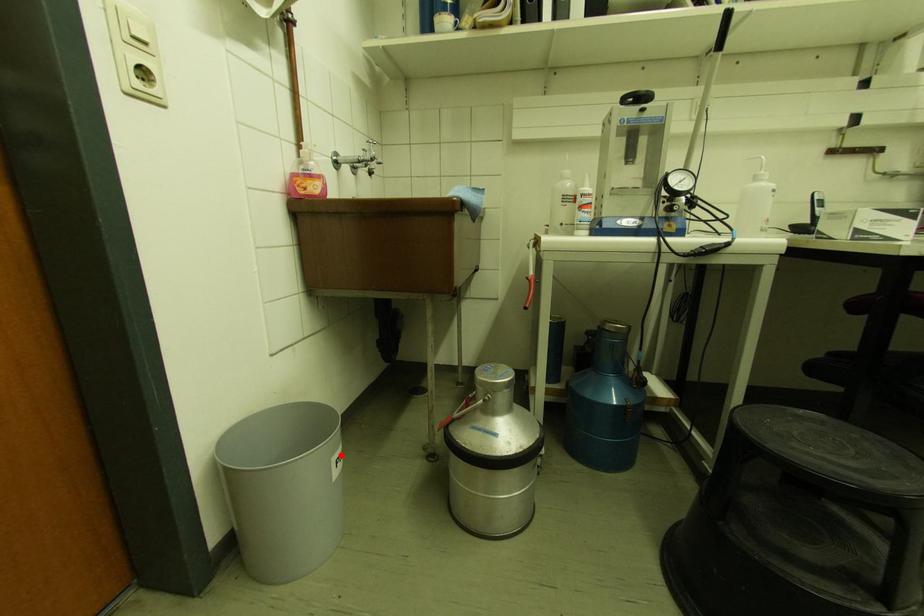
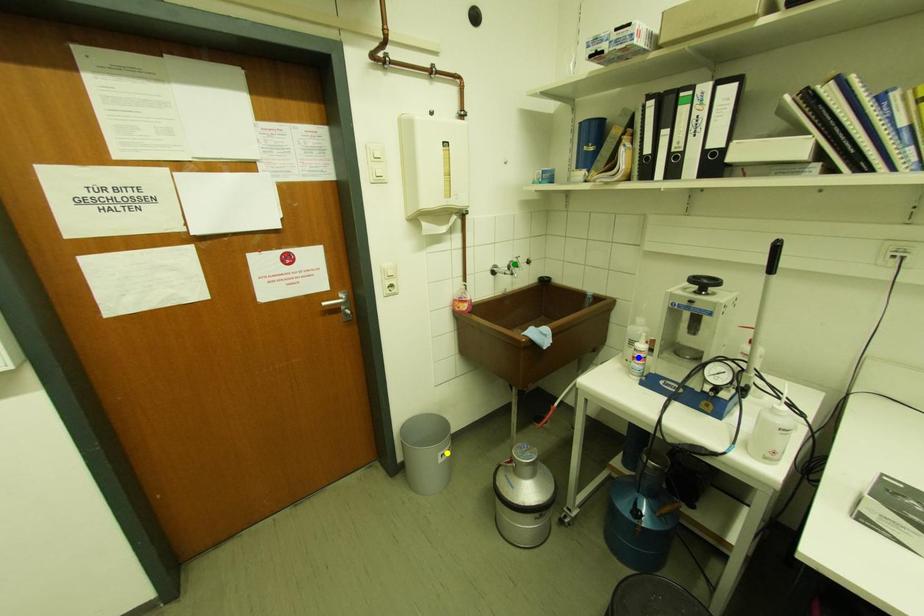
Question: I am providing you with two images of the same scene from different viewpoints. A red point is marked on the first image. You are given multiple points on the second image. Which mark in image 2 goes with the point in image 1?

Choices:
 (A) blue point
 (B) green point
 (C) yellow point

Answer: (C)